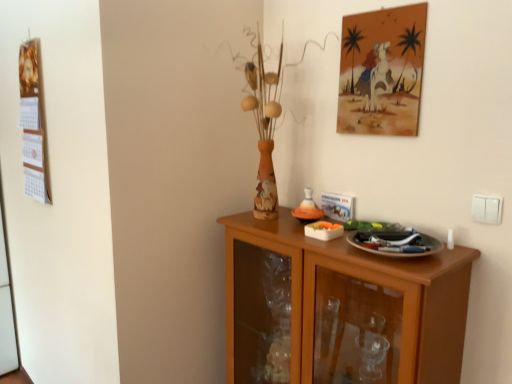
Question: Can you confirm if watercolor painting at upper right is taller than white plastic switch at right?

Choices:
 (A) no
 (B) yes

Answer: (B)

Question: From a real-world perspective, is watercolor painting at upper right located higher than white plastic switch at right?

Choices:
 (A) yes
 (B) no

Answer: (A)

Question: Can you confirm if watercolor painting at upper right is shorter than white plastic switch at right?

Choices:
 (A) no
 (B) yes

Answer: (A)

Question: Can white plastic switch at right be found inside watercolor painting at upper right?

Choices:
 (A) yes
 (B) no

Answer: (B)

Question: From the image's perspective, is watercolor painting at upper right on white plastic switch at right?

Choices:
 (A) yes
 (B) no

Answer: (A)

Question: Considering the positions of white plastic switch at right and wooden calendar at left in the image, is white plastic switch at right bigger or smaller than wooden calendar at left?

Choices:
 (A) big
 (B) small

Answer: (B)

Question: Is white plastic switch at right inside or outside of wooden calendar at left?

Choices:
 (A) inside
 (B) outside

Answer: (B)

Question: Is white plastic switch at right wider or thinner than wooden calendar at left?

Choices:
 (A) thin
 (B) wide

Answer: (A)

Question: From the image's perspective, is white plastic switch at right located above or below wooden calendar at left?

Choices:
 (A) above
 (B) below

Answer: (B)

Question: From the image's perspective, relative to watercolor painting at upper right, is white plastic switch at right above or below?

Choices:
 (A) above
 (B) below

Answer: (B)

Question: Relative to watercolor painting at upper right, is white plastic switch at right in front or behind?

Choices:
 (A) front
 (B) behind

Answer: (A)

Question: Looking at their shapes, would you say white plastic switch at right is wider or thinner than watercolor painting at upper right?

Choices:
 (A) wide
 (B) thin

Answer: (B)

Question: Is white plastic switch at right situated inside watercolor painting at upper right or outside?

Choices:
 (A) outside
 (B) inside

Answer: (A)

Question: Considering the positions of wooden calendar at left and white plastic switch at right in the image, is wooden calendar at left taller or shorter than white plastic switch at right?

Choices:
 (A) short
 (B) tall

Answer: (B)

Question: In terms of width, does wooden calendar at left look wider or thinner when compared to white plastic switch at right?

Choices:
 (A) thin
 (B) wide

Answer: (B)